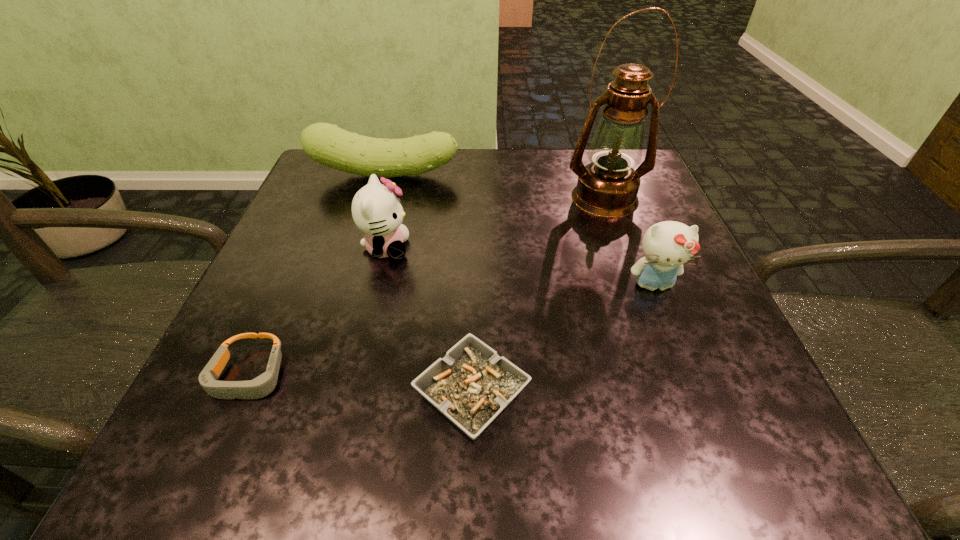
Choose which object is the fifth nearest neighbor to the tallest object. Please provide its 2D coordinates. Your answer should be formatted as a tuple, i.e. [(x, y)], where the tuple contains the x and y coordinates of a point satisfying the conditions above.

[(261, 386)]

Image resolution: width=960 pixels, height=540 pixels. In order to click on object that is the fourth closest to the left kitten in this screenshot , I will do `click(607, 187)`.

Find the location of a particular element. The height and width of the screenshot is (540, 960). free location that satisfies the following two spatial constraints: 1. on the front-facing side of the ashtray; 2. on the left side of the left kitten is located at coordinates [x=351, y=394].

Find the location of a particular element. vacant space that satisfies the following two spatial constraints: 1. on the back side of the ashtray; 2. on the right side of the oil lamp is located at coordinates (475, 198).